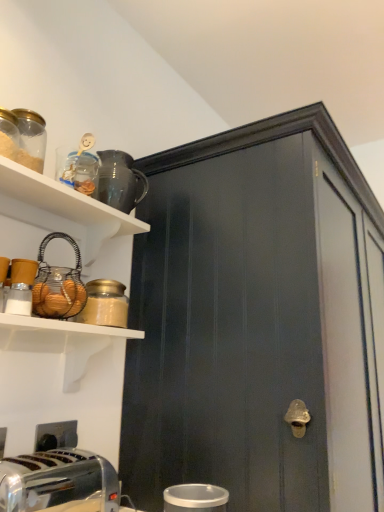
This screenshot has width=384, height=512. Describe the element at coordinates (58, 284) in the screenshot. I see `wire basket at upper left, the 2th appliance from the top` at that location.

The height and width of the screenshot is (512, 384). What are the coordinates of `matte glass jar at upper left` in the screenshot? It's located at (105, 304).

What is the approximate height of polished chrome toaster at lower left?

The height of polished chrome toaster at lower left is 7.32 inches.

The width and height of the screenshot is (384, 512). I want to click on wire basket at upper left, the 2th appliance from the top, so click(58, 284).

Identify the location of shelf above the white glossy cup at lower center, the first appliance from the bottom (from a real-world perspective). This screenshot has width=384, height=512. (61, 209).

Is white glossy cup at lower center, the third appliance from the left, beside matte black mug at upper left?

white glossy cup at lower center, the third appliance from the left, is not next to matte black mug at upper left, and they're not touching.

Which object is further away from the camera, white glossy cup at lower center, the third appliance positioned from the top, or matte black mug at upper left?

matte black mug at upper left is behind.

Does white glossy cup at lower center, the first appliance from the bottom, have a lesser width compared to glossy ceramic pitcher at upper center, the 3th appliance when ordered from bottom to top?

Indeed, white glossy cup at lower center, the first appliance from the bottom, has a lesser width compared to glossy ceramic pitcher at upper center, the 3th appliance when ordered from bottom to top.

Which is further, (189, 507) or (106, 177)?

The point (106, 177) is farther from the camera.

Which object is further away from the camera, white glossy cup at lower center, the third appliance from the left, or glossy ceramic pitcher at upper center, the 2th appliance when ordered from left to right?

Positioned behind is glossy ceramic pitcher at upper center, the 2th appliance when ordered from left to right.

Who is smaller, white glossy cup at lower center, the third appliance viewed from the back, or glossy ceramic pitcher at upper center, which is counted as the first appliance, starting from the top?

Smaller between the two is white glossy cup at lower center, the third appliance viewed from the back.

Can you see wire basket at upper left, acting as the 3th appliance starting from the right, touching polished chrome toaster at lower left?

No, wire basket at upper left, acting as the 3th appliance starting from the right, is not touching polished chrome toaster at lower left.

In terms of width, does wire basket at upper left, which appears as the 2th appliance when viewed from the back, look wider or thinner when compared to polished chrome toaster at lower left?

wire basket at upper left, which appears as the 2th appliance when viewed from the back, is thinner than polished chrome toaster at lower left.

Which is more to the left, wire basket at upper left, the 2th appliance from the top, or polished chrome toaster at lower left?

Positioned to the left is polished chrome toaster at lower left.

Is wire basket at upper left, the 1th appliance when ordered from left to right, positioned with its back to polished chrome toaster at lower left?

wire basket at upper left, the 1th appliance when ordered from left to right, does not have its back to polished chrome toaster at lower left.

This screenshot has width=384, height=512. I want to click on bottle that appears behind the matte black mug at upper left, so click(105, 304).

Does point (84, 311) lie behind point (69, 201)?

Yes.

Can you confirm if matte glass jar at upper left is bigger than matte black mug at upper left?

Actually, matte glass jar at upper left might be smaller than matte black mug at upper left.

In terms of height, does matte glass jar at upper left look taller or shorter compared to matte black mug at upper left?

matte glass jar at upper left is shorter than matte black mug at upper left.

Which of these two, matte black mug at upper left or white glossy cup at lower center, the 1th appliance positioned from the front, is smaller?

white glossy cup at lower center, the 1th appliance positioned from the front, is smaller.

The width and height of the screenshot is (384, 512). I want to click on shelf above the white glossy cup at lower center, the 1th appliance positioned from the front (from the image's perspective), so click(x=61, y=209).

In the scene shown: Choose the correct answer: Is matte black mug at upper left inside white glossy cup at lower center, the third appliance viewed from the back, or outside it?

matte black mug at upper left is outside white glossy cup at lower center, the third appliance viewed from the back.

Which of these two, matte black mug at upper left or white glossy cup at lower center, the first appliance viewed from the right, stands shorter?

matte black mug at upper left.

Between matte black cabinet at center and glossy ceramic pitcher at upper center, acting as the 1th appliance starting from the back, which one has more height?

matte black cabinet at center is taller.

Considering the positions of objects matte black cabinet at center and glossy ceramic pitcher at upper center, which is counted as the first appliance, starting from the top, in the image provided, who is more to the left, matte black cabinet at center or glossy ceramic pitcher at upper center, which is counted as the first appliance, starting from the top,?

From the viewer's perspective, glossy ceramic pitcher at upper center, which is counted as the first appliance, starting from the top, appears more on the left side.

Identify the location of cabinetry to the right of glossy ceramic pitcher at upper center, placed as the third appliance when sorted from front to back. (258, 322).

Can you tell me how much matte black cabinet at center and glossy ceramic pitcher at upper center, which appears as the second appliance when viewed from the right, differ in facing direction?

matte black cabinet at center and glossy ceramic pitcher at upper center, which appears as the second appliance when viewed from the right, are facing 0.655 degrees away from each other.

Is glossy ceramic pitcher at upper center, acting as the 1th appliance starting from the back, far away from white glossy cup at lower center, the third appliance viewed from the back?

No, glossy ceramic pitcher at upper center, acting as the 1th appliance starting from the back, is not far away from white glossy cup at lower center, the third appliance viewed from the back.

Based on their positions, is glossy ceramic pitcher at upper center, acting as the 1th appliance starting from the back, located to the left or right of white glossy cup at lower center, the first appliance from the bottom?

glossy ceramic pitcher at upper center, acting as the 1th appliance starting from the back, is to the left of white glossy cup at lower center, the first appliance from the bottom.

Is glossy ceramic pitcher at upper center, which is counted as the first appliance, starting from the top, aimed at white glossy cup at lower center, the first appliance viewed from the right?

No, glossy ceramic pitcher at upper center, which is counted as the first appliance, starting from the top, is not turned towards white glossy cup at lower center, the first appliance viewed from the right.

In order to click on shelf behind the white glossy cup at lower center, the third appliance viewed from the back in this screenshot , I will do `click(61, 209)`.

From the white glossy cup at lower center, the third appliance positioned from the top, count the 1st appliance to the left and point to it. Please provide its 2D coordinates.

[(120, 181)]

Consider the image. Considering their positions, is matte black mug at upper left positioned closer to polished chrome toaster at lower left than white glossy cup at lower center, the third appliance positioned from the top?

white glossy cup at lower center, the third appliance positioned from the top.

Based on their spatial positions, is matte black mug at upper left or wire basket at upper left, the 1th appliance when ordered from left to right, closer to matte black cabinet at center?

Based on the image, matte black mug at upper left appears to be nearer to matte black cabinet at center.

Which object lies further to the anchor point matte black cabinet at center, polished chrome toaster at lower left or matte glass jar at upper left?

polished chrome toaster at lower left is positioned further to the anchor matte black cabinet at center.

Looking at the image, which one is located closer to matte black cabinet at center, matte glass jar at upper left or matte black mug at upper left?

matte black mug at upper left is positioned closer to the anchor matte black cabinet at center.

When comparing their distances from wire basket at upper left, acting as the 3th appliance starting from the right, does polished chrome toaster at lower left or glossy ceramic pitcher at upper center, the 2th appliance when ordered from left to right, seem closer?

glossy ceramic pitcher at upper center, the 2th appliance when ordered from left to right, is positioned closer to the anchor wire basket at upper left, acting as the 3th appliance starting from the right.

When comparing their distances from wire basket at upper left, the 1th appliance when ordered from left to right, does glossy ceramic pitcher at upper center, which appears as the second appliance when viewed from the right, or polished chrome toaster at lower left seem further?

polished chrome toaster at lower left.

Based on their spatial positions, is glossy ceramic pitcher at upper center, placed as the third appliance when sorted from front to back, or wire basket at upper left, which is counted as the second appliance, starting from the bottom, closer to polished chrome toaster at lower left?

Based on the image, wire basket at upper left, which is counted as the second appliance, starting from the bottom, appears to be nearer to polished chrome toaster at lower left.

Considering their positions, is matte black mug at upper left positioned closer to wire basket at upper left, which appears as the 2th appliance when viewed from the back, than glossy ceramic pitcher at upper center, which is counted as the first appliance, starting from the top?

matte black mug at upper left lies closer to wire basket at upper left, which appears as the 2th appliance when viewed from the back, than the other object.

Locate an element on the screen. Image resolution: width=384 pixels, height=512 pixels. bottle between polished chrome toaster at lower left and matte black cabinet at center is located at coordinates (105, 304).

Locate an element on the screen. The image size is (384, 512). cabinetry between glossy ceramic pitcher at upper center, which appears as the second appliance when viewed from the right, and polished chrome toaster at lower left, in the vertical direction is located at coordinates (258, 322).

At what (x,y) coordinates should I click in order to perform the action: click on bottle between matte black mug at upper left and matte black cabinet at center. Please return your answer as a coordinate pair (x, y). This screenshot has height=512, width=384. Looking at the image, I should click on (105, 304).

The image size is (384, 512). In order to click on shelf between glossy ceramic pitcher at upper center, which is counted as the first appliance, starting from the top, and white glossy cup at lower center, the 1th appliance positioned from the front, from top to bottom in this screenshot , I will do `click(61, 209)`.